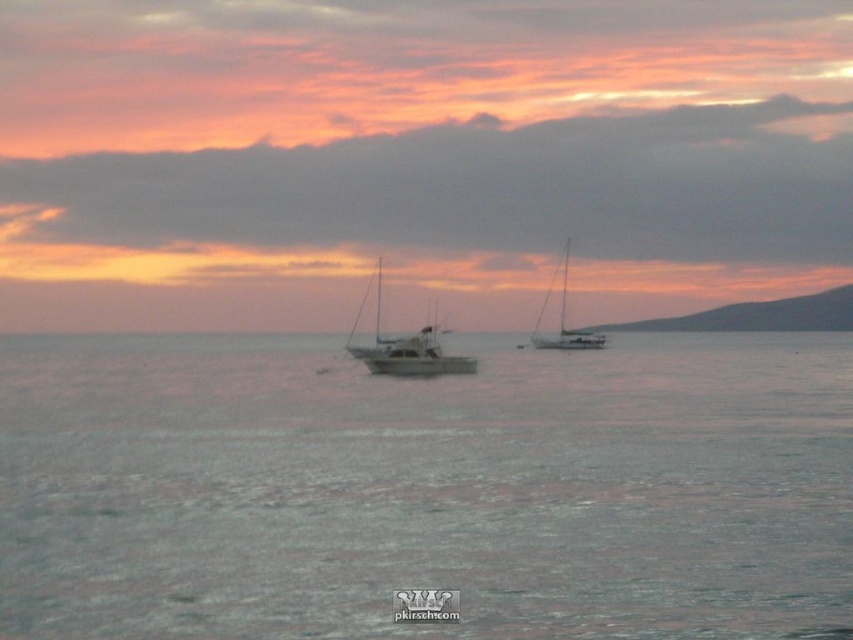
From the picture: You are a photographer planning to take a photo of the two sailboats in the serene seascape. You want to ensure that both the white matte sailboat at center and the metallic silver sailboat at center are clearly visible in the frame. Given their sizes, which sailboat will appear larger in your photo?

The white matte sailboat at center will appear larger in the photo because it is bigger than the metallic silver sailboat at center according to the description.

You are standing on the shore of the seascape depicted in the image. There is a gray matte water at center marked by point (425, 488). If you want to walk towards that point, which direction should you head?

The gray matte water at center is located at point (425, 488), so you should head towards the center of the image to reach that point.